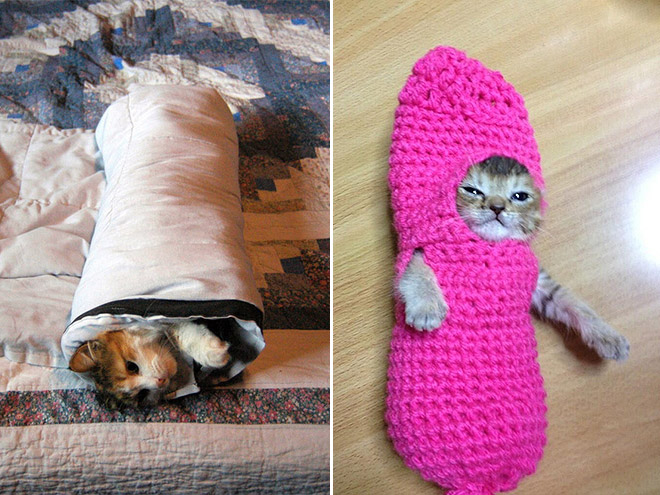
You are a GUI agent. You are given a task and a screenshot of the screen. Output one action in this format:
    pyautogui.click(x=<x>, y=<y>)
    Task: Click on the blanket
    This screenshot has height=495, width=660.
    Given the screenshot: What is the action you would take?
    coord(183,238)